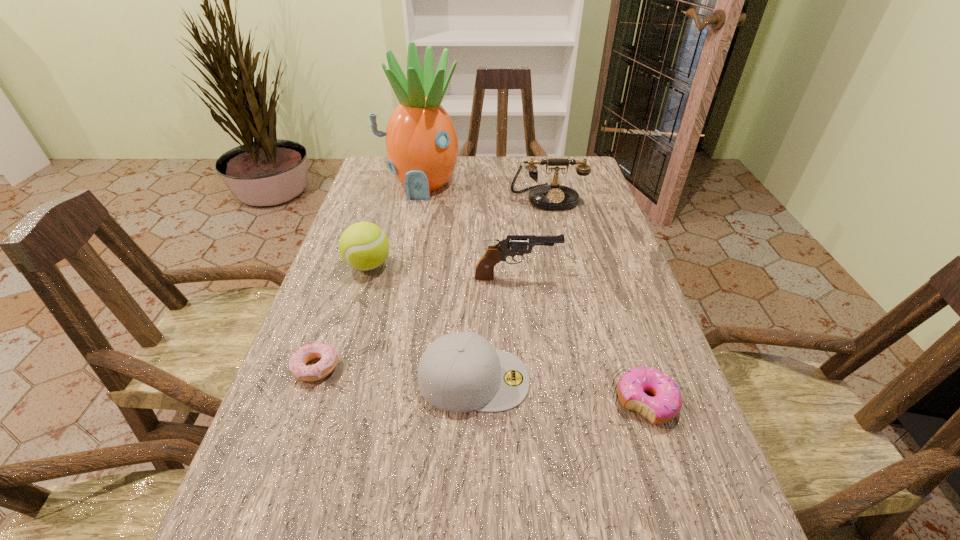
The width and height of the screenshot is (960, 540). Identify the location of vacant position in the image that satisfies the following two spatial constraints: 1. on the front-facing side of the cap; 2. on the left side of the right doughnut. coord(473,402).

Where is `free point that satisfies the following two spatial constraints: 1. on the back side of the sixth tallest object; 2. along the barrel of the gun`? Image resolution: width=960 pixels, height=540 pixels. free point that satisfies the following two spatial constraints: 1. on the back side of the sixth tallest object; 2. along the barrel of the gun is located at coordinates (606, 278).

This screenshot has height=540, width=960. I want to click on vacant region that satisfies the following two spatial constraints: 1. along the barrel of the gun; 2. on the right side of the right doughnut, so click(x=529, y=402).